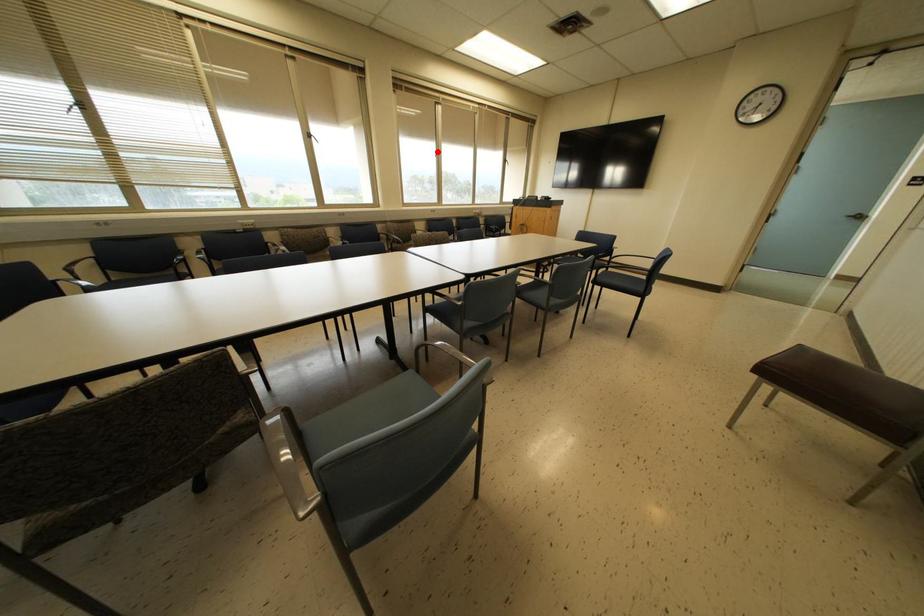
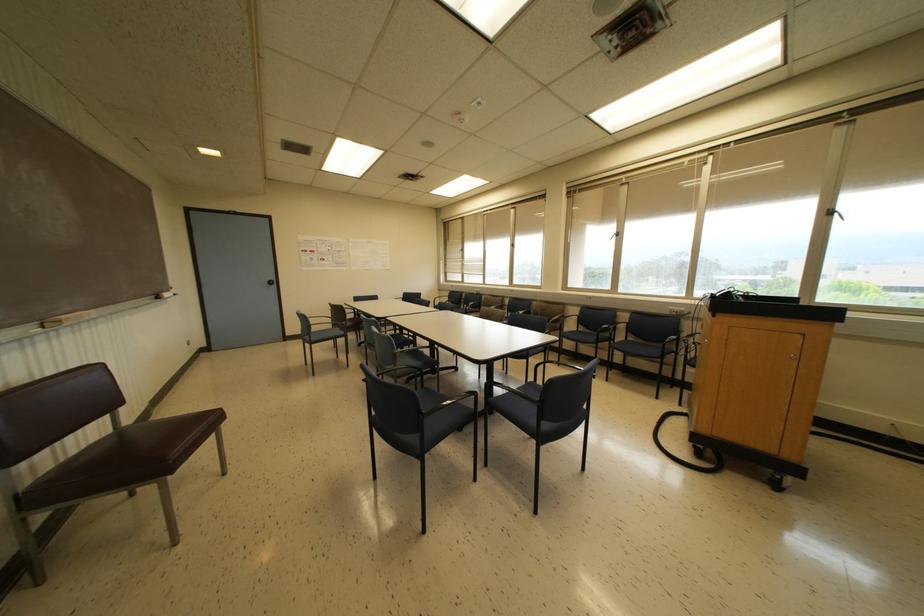
Question: I am providing you with two images of the same scene from different viewpoints. Image1 has a red point marked. In image2, the corresponding 3D location appears at what relative position? Reply with the corresponding letter.

Choices:
 (A) Closer
 (B) Farther

Answer: (B)